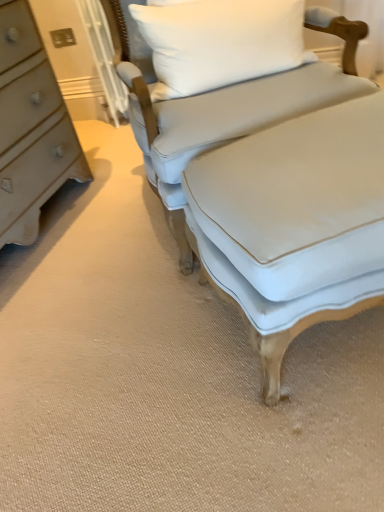
Question: Visually, is light blue fabric couch at center positioned to the left or to the right of light blue fabric ottoman at center?

Choices:
 (A) right
 (B) left

Answer: (B)

Question: In terms of width, does light blue fabric couch at center look wider or thinner when compared to light blue fabric ottoman at center?

Choices:
 (A) wide
 (B) thin

Answer: (A)

Question: Estimate the real-world distances between objects in this image. Which object is farther from the white fabric pillow at upper center?

Choices:
 (A) light blue fabric couch at center
 (B) light blue fabric ottoman at center

Answer: (B)

Question: Which object is the closest to the light blue fabric couch at center?

Choices:
 (A) light blue fabric ottoman at center
 (B) white fabric pillow at upper center

Answer: (B)